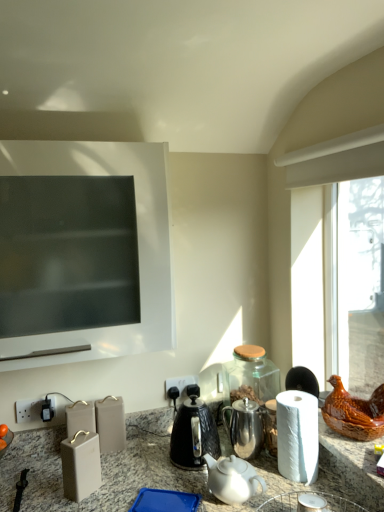
Question: Relative to shiny metallic teapot at center, is white paper at right in front or behind?

Choices:
 (A) front
 (B) behind

Answer: (A)

Question: From a real-world perspective, is white paper at right above or below shiny metallic teapot at center?

Choices:
 (A) below
 (B) above

Answer: (B)

Question: Estimate the real-world distances between objects in this image. Which object is farther from the white ceramic teapot at center?

Choices:
 (A) white paper at right
 (B) shiny metallic teapot at center
 (C) black plastic electric outlet at lower center
 (D) matte gray knife block at center
 (E) black textured kettle at center

Answer: (C)

Question: Which object is the closest to the white ceramic teapot at center?

Choices:
 (A) shiny metallic teapot at center
 (B) white paper at right
 (C) matte gray knife block at center
 (D) black plastic electric outlet at lower center
 (E) black textured kettle at center

Answer: (E)